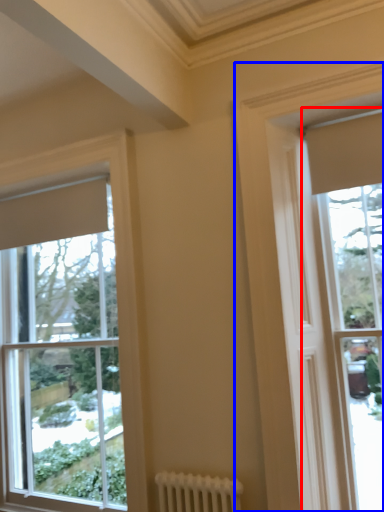
Question: Which of the following is the farthest to the observer, window (highlighted by a red box) or window (highlighted by a blue box)?

Choices:
 (A) window
 (B) window

Answer: (A)